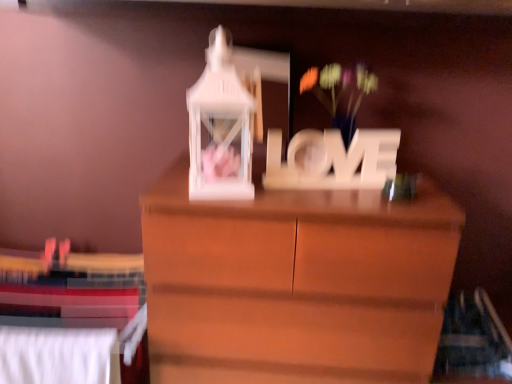
What do you see at coordinates (70, 288) in the screenshot? The image size is (512, 384). I see `white fabric bed at lower left` at bounding box center [70, 288].

Identify the location of wooden "love" sign at center. The height and width of the screenshot is (384, 512). (332, 160).

Considering the sizes of objects white fabric bed at lower left and white matte floral arrangement at center in the image provided, who is wider, white fabric bed at lower left or white matte floral arrangement at center?

With larger width is white matte floral arrangement at center.

Is white fabric bed at lower left facing away from white matte floral arrangement at center?

No, white fabric bed at lower left is not facing away from white matte floral arrangement at center.

Is white fabric bed at lower left far from white matte floral arrangement at center?

Yes.

From the image's perspective, does white fabric bed at lower left appear lower than wooden "love" sign at center?

Indeed, from the image's perspective, white fabric bed at lower left is shown beneath wooden "love" sign at center.

Is point (111, 273) positioned in front of point (271, 169)?

No, (111, 273) is further to viewer.

Is the depth of white fabric bed at lower left less than that of wooden "love" sign at center?

No, white fabric bed at lower left is behind wooden "love" sign at center.

Does white fabric bed at lower left turn towards wooden "love" sign at center?

No, white fabric bed at lower left does not turn towards wooden "love" sign at center.

From the image's perspective, is white matte floral arrangement at center positioned above or below wooden "love" sign at center?

Based on their image positions, white matte floral arrangement at center is located above wooden "love" sign at center.

Does white matte floral arrangement at center contain wooden "love" sign at center?

No, wooden "love" sign at center is located outside of white matte floral arrangement at center.

Does point (348, 104) appear closer or farther from the camera than point (360, 182)?

Point (348, 104).

Between white matte floral arrangement at center and wooden "love" sign at center, which one has less height?

wooden "love" sign at center is shorter.

Is wooden "love" sign at center surrounding white matte floral arrangement at center?

No, wooden "love" sign at center does not contain white matte floral arrangement at center.

Does wooden "love" sign at center turn towards white matte floral arrangement at center?

No, wooden "love" sign at center does not turn towards white matte floral arrangement at center.

Is wooden "love" sign at center far from white matte floral arrangement at center?

Actually, wooden "love" sign at center and white matte floral arrangement at center are a little close together.

Which of these two, wooden "love" sign at center or white matte floral arrangement at center, stands shorter?

Standing shorter between the two is wooden "love" sign at center.

From the image's perspective, is wooden "love" sign at center beneath white fabric bed at lower left?

No.

Between point (294, 179) and point (9, 285), which one is positioned behind?

Point (9, 285)

From a real-world perspective, who is located lower, wooden "love" sign at center or white fabric bed at lower left?

white fabric bed at lower left, from a real-world perspective.

Considering the positions of objects wooden "love" sign at center and white fabric bed at lower left in the image provided, who is more to the left, wooden "love" sign at center or white fabric bed at lower left?

From the viewer's perspective, white fabric bed at lower left appears more on the left side.

Would you say white matte floral arrangement at center is to the left or to the right of white fabric bed at lower left in the picture?

white matte floral arrangement at center is positioned on white fabric bed at lower left's right side.

Is white matte floral arrangement at center positioned far away from white fabric bed at lower left?

white matte floral arrangement at center is positioned a significant distance from white fabric bed at lower left.

Considering the points (342, 129) and (63, 282), which point is in front, point (342, 129) or point (63, 282)?

The point (342, 129) is more forward.

How many degrees apart are the facing directions of white matte floral arrangement at center and white fabric bed at lower left?

2.83 degrees separate the facing orientations of white matte floral arrangement at center and white fabric bed at lower left.

Locate an element on the screen. This screenshot has height=384, width=512. bed behind the white matte floral arrangement at center is located at coordinates (70, 288).

Identify the location of bed located on the left of wooden "love" sign at center. (70, 288).

Which object lies further to the anchor point wooden "love" sign at center, white matte floral arrangement at center or white fabric bed at lower left?

white fabric bed at lower left is positioned further to the anchor wooden "love" sign at center.

Considering their positions, is white fabric bed at lower left positioned closer to wooden "love" sign at center than white matte floral arrangement at center?

white matte floral arrangement at center is positioned closer to the anchor wooden "love" sign at center.

Based on their spatial positions, is wooden "love" sign at center or white fabric bed at lower left closer to white matte floral arrangement at center?

Among the two, wooden "love" sign at center is located nearer to white matte floral arrangement at center.

Estimate the real-world distances between objects in this image. Which object is further from white fabric bed at lower left, white matte floral arrangement at center or wooden "love" sign at center?

Among the two, white matte floral arrangement at center is located further to white fabric bed at lower left.

Based on their spatial positions, is white fabric bed at lower left or wooden "love" sign at center closer to white matte floral arrangement at center?

wooden "love" sign at center is positioned closer to the anchor white matte floral arrangement at center.

Considering their positions, is wooden "love" sign at center positioned closer to white fabric bed at lower left than white matte floral arrangement at center?

wooden "love" sign at center lies closer to white fabric bed at lower left than the other object.

Find the location of a particular element. Image resolution: width=512 pixels, height=384 pixels. letter situated between white fabric bed at lower left and white matte floral arrangement at center from left to right is located at coordinates click(332, 160).